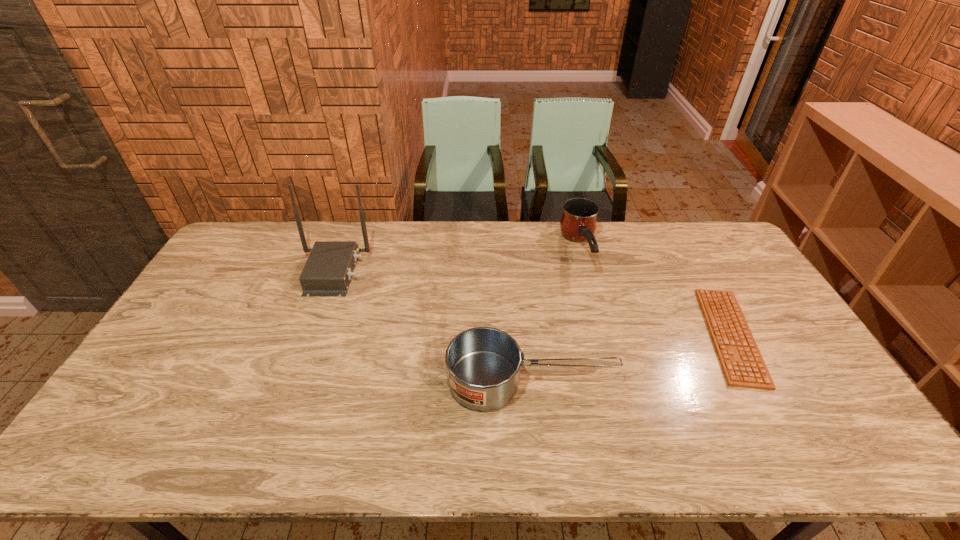
Where is `object that ranks as the third closest to the computer keyboard`? This screenshot has width=960, height=540. object that ranks as the third closest to the computer keyboard is located at coordinates (328, 270).

Locate an element on the screen. The image size is (960, 540). the closest object to the router is located at coordinates (483, 364).

Where is `vacant space that satisfies the following two spatial constraints: 1. on the handle side of the farther saucepan; 2. on the back of the tallest object to connect cables`? This screenshot has height=540, width=960. vacant space that satisfies the following two spatial constraints: 1. on the handle side of the farther saucepan; 2. on the back of the tallest object to connect cables is located at coordinates (586, 272).

Where is `free space that satisfies the following two spatial constraints: 1. on the back side of the shortest object; 2. on the back of the router to connect cables`? free space that satisfies the following two spatial constraints: 1. on the back side of the shortest object; 2. on the back of the router to connect cables is located at coordinates (695, 272).

Locate an element on the screen. The image size is (960, 540). vacant space that satisfies the following two spatial constraints: 1. on the back side of the rightmost object; 2. on the back of the leftmost object to connect cables is located at coordinates pos(695,272).

Locate an element on the screen. The width and height of the screenshot is (960, 540). free spot that satisfies the following two spatial constraints: 1. on the back of the leftmost object to connect cables; 2. on the right side of the rightmost object is located at coordinates (309, 335).

This screenshot has height=540, width=960. Identify the location of free region that satisfies the following two spatial constraints: 1. on the handle side of the farther saucepan; 2. on the back of the tallest object to connect cables. (586, 272).

You are a GUI agent. You are given a task and a screenshot of the screen. Output one action in this format:
    pyautogui.click(x=<x>, y=<y>)
    Task: Click on the vacant area in the image that satisfies the following two spatial constraints: 1. on the front side of the shortest object; 2. with the handle extending from one side of the shorter saucepan
    
    Given the screenshot: What is the action you would take?
    pyautogui.click(x=756, y=381)

Where is `free space that satisfies the following two spatial constraints: 1. on the back of the router to connect cables; 2. on the left side of the computer keyboard`? free space that satisfies the following two spatial constraints: 1. on the back of the router to connect cables; 2. on the left side of the computer keyboard is located at coordinates (309, 335).

At what (x,y) coordinates should I click in order to perform the action: click on vacant area that satisfies the following two spatial constraints: 1. on the handle side of the rightmost object; 2. on the right side of the taller saucepan. Please return your answer as a coordinate pair (x, y). Looking at the image, I should click on (603, 335).